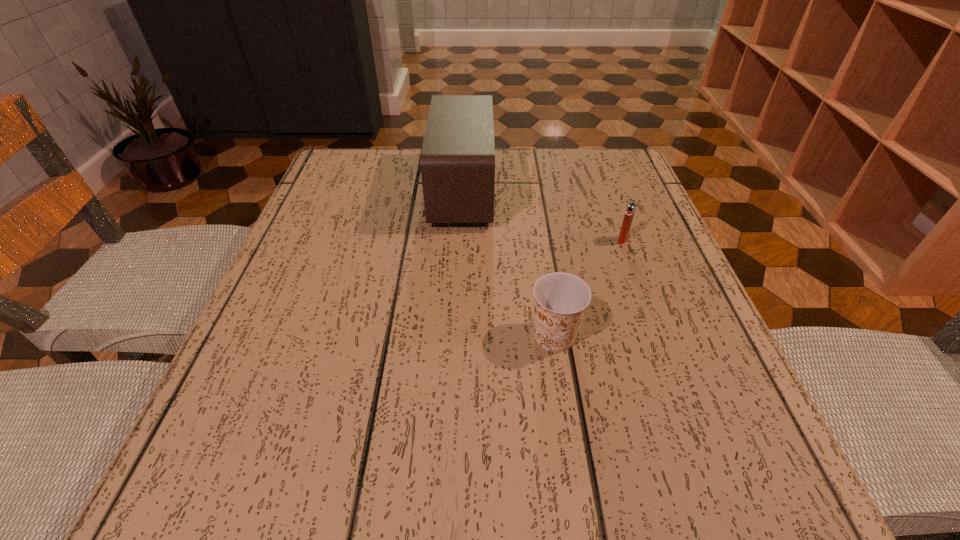
Find the location of `unoccupied area between the tallest object and the Dixie cup`. unoccupied area between the tallest object and the Dixie cup is located at coordinates (509, 264).

Where is `free space between the leftmost object and the igniter`? The height and width of the screenshot is (540, 960). free space between the leftmost object and the igniter is located at coordinates pyautogui.click(x=542, y=215).

Where is `free spot between the leftmost object and the second object from right to left`? free spot between the leftmost object and the second object from right to left is located at coordinates (509, 264).

Locate an element on the screen. Image resolution: width=960 pixels, height=540 pixels. free point between the second object from right to left and the farthest object is located at coordinates (509, 264).

Find the location of `vacant space that's between the farthest object and the nearest object`. vacant space that's between the farthest object and the nearest object is located at coordinates (509, 264).

Identify the location of free space between the shortest object and the tallest object. The width and height of the screenshot is (960, 540). (542, 215).

The width and height of the screenshot is (960, 540). I want to click on empty space that is in between the rightmost object and the tallest object, so click(542, 215).

The width and height of the screenshot is (960, 540). I want to click on object that can be found as the second closest to the farthest object, so click(631, 207).

Select which object is the second closest to the tallest object. Please provide its 2D coordinates. Your answer should be formatted as a tuple, i.e. [(x, y)], where the tuple contains the x and y coordinates of a point satisfying the conditions above.

[(631, 207)]

Image resolution: width=960 pixels, height=540 pixels. Identify the location of free space in the image that satisfies the following two spatial constraints: 1. on the front-facing side of the shortest object; 2. on the right side of the leftmost object. (460, 240).